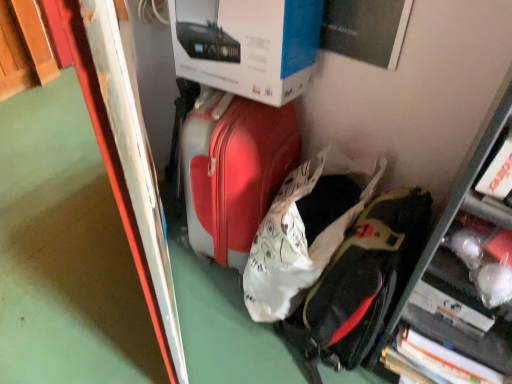
Question: Considering the relative sizes of matte red suitcase at center and black matte backpack at lower right in the image provided, is matte red suitcase at center bigger than black matte backpack at lower right?

Choices:
 (A) yes
 (B) no

Answer: (A)

Question: Considering the relative sizes of matte red suitcase at center and black matte backpack at lower right in the image provided, is matte red suitcase at center shorter than black matte backpack at lower right?

Choices:
 (A) yes
 (B) no

Answer: (B)

Question: Can we say matte red suitcase at center lies outside black matte backpack at lower right?

Choices:
 (A) no
 (B) yes

Answer: (B)

Question: Can you confirm if matte red suitcase at center is taller than black matte backpack at lower right?

Choices:
 (A) yes
 (B) no

Answer: (A)

Question: From the image's perspective, is matte red suitcase at center above black matte backpack at lower right?

Choices:
 (A) no
 (B) yes

Answer: (B)

Question: Is black matte backpack at lower right a part of matte red suitcase at center?

Choices:
 (A) yes
 (B) no

Answer: (B)

Question: Considering the relative sizes of matte red suitcase at center and metallic silver bulletin board at left in the image provided, is matte red suitcase at center bigger than metallic silver bulletin board at left?

Choices:
 (A) yes
 (B) no

Answer: (B)

Question: Is matte red suitcase at center smaller than metallic silver bulletin board at left?

Choices:
 (A) no
 (B) yes

Answer: (B)

Question: From the image's perspective, would you say matte red suitcase at center is shown under metallic silver bulletin board at left?

Choices:
 (A) no
 (B) yes

Answer: (B)

Question: From the image's perspective, does matte red suitcase at center appear higher than metallic silver bulletin board at left?

Choices:
 (A) yes
 (B) no

Answer: (B)

Question: Is matte red suitcase at center to the right of metallic silver bulletin board at left from the viewer's perspective?

Choices:
 (A) no
 (B) yes

Answer: (B)

Question: Is matte red suitcase at center far from metallic silver bulletin board at left?

Choices:
 (A) yes
 (B) no

Answer: (B)

Question: Is metallic silver bulletin board at left not near white cardboard box at upper center?

Choices:
 (A) yes
 (B) no

Answer: (B)